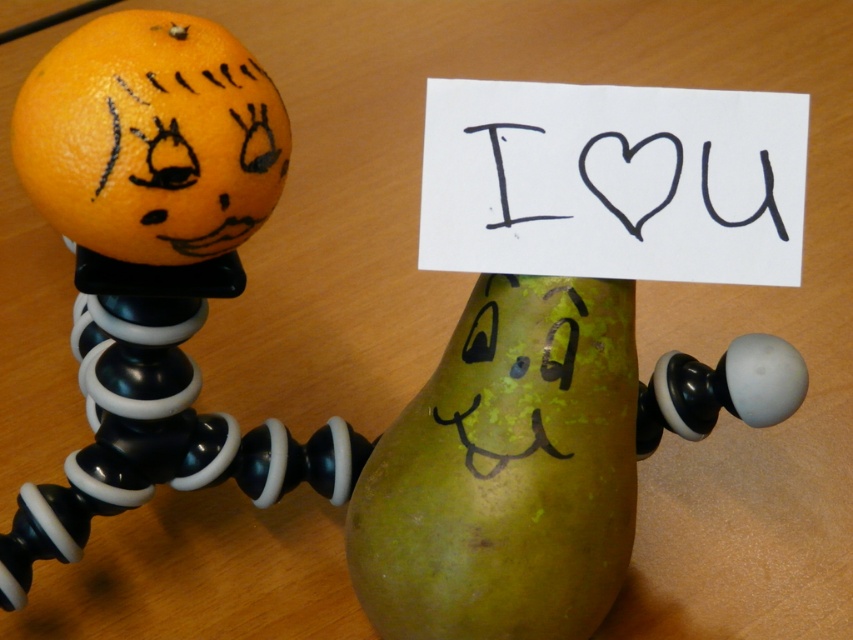
You are an artist who wants to draw the green matte pear at center and the black paper at center as seen from the front. Which object will appear larger in your drawing?

The green matte pear at center will appear larger in the drawing because it is positioned in front of the black paper at center, making it closer to the viewer.

You are organizing a childrens party and have a green matte pear at center and a black paper at center on a table. You need to place a small sticker on the larger of the two items. Which item should you place the sticker on?

The green matte pear at center is larger than the black paper at center, so you should place the sticker on the green matte pear at center.

Consider the image. You are holding a ruler that is 1 meter long. You want to measure the distance between yourself and the point marked at coordinates (230, 115) in the image. Will the ruler be long enough to measure this distance?

The distance between you and the point marked at coordinates (230, 115) is 86.34 centimeters. Since the ruler is 1 meter long, which is longer than 86.34 centimeters, the ruler will be long enough to measure this distance.